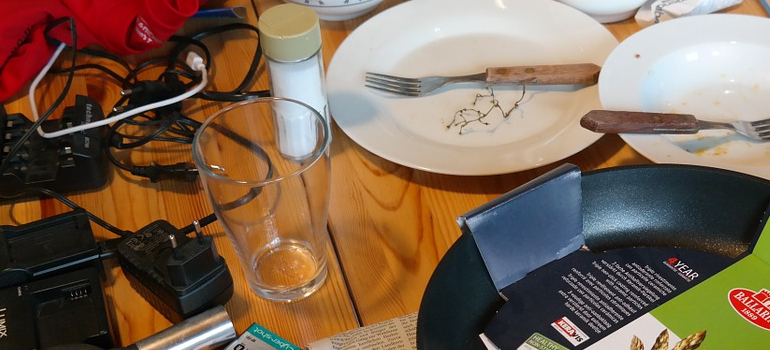
Where is `wooden handle`? This screenshot has height=350, width=770. wooden handle is located at coordinates (571, 71), (645, 121).